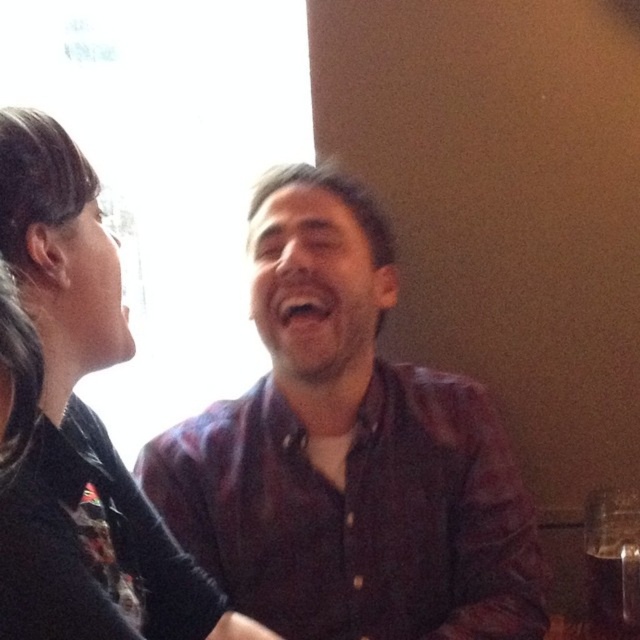
Consider the image. Does dark brown shirt at center have a lesser width compared to black leather jacket at upper left?

In fact, dark brown shirt at center might be wider than black leather jacket at upper left.

Is point (451, 621) less distant than point (156, 614)?

No, (451, 621) is further to viewer.

Where is `dark brown shirt at center`? The width and height of the screenshot is (640, 640). dark brown shirt at center is located at coordinates pyautogui.click(x=346, y=452).